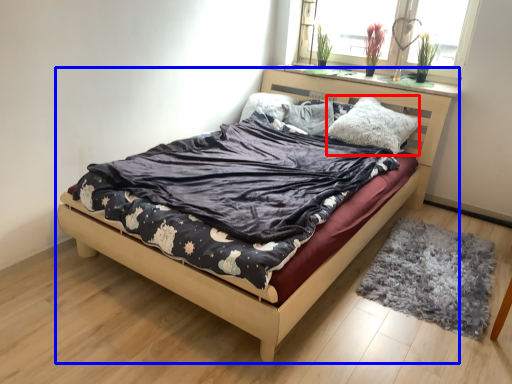
Question: Which point is closer to the camera, pillow (highlighted by a red box) or bed (highlighted by a blue box)?

Choices:
 (A) pillow
 (B) bed

Answer: (B)